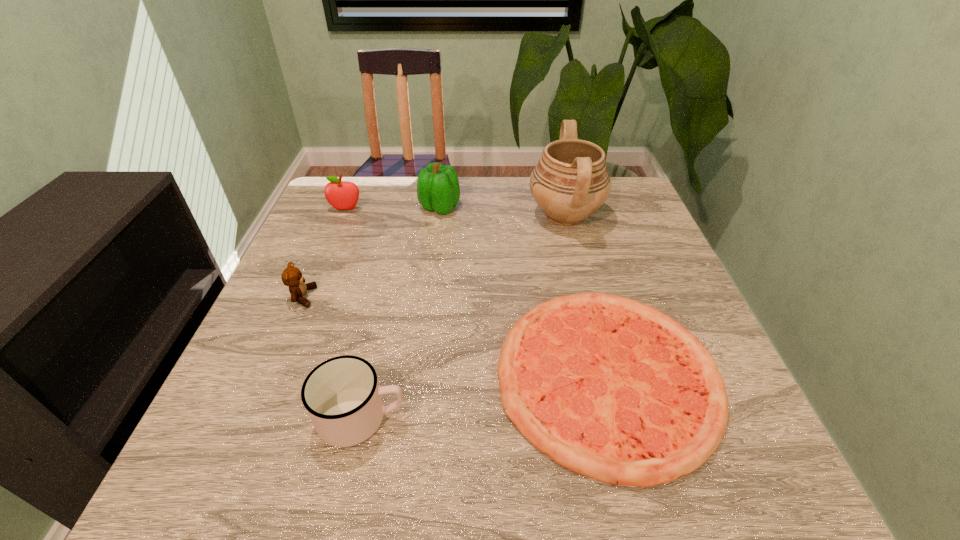
You are a GUI agent. You are given a task and a screenshot of the screen. Output one action in this format:
    pyautogui.click(x=<x>, y=<y>)
    Task: Click on the urn
    Image resolution: width=960 pixels, height=540 pixels.
    Given the screenshot: What is the action you would take?
    pyautogui.click(x=570, y=182)

Find the location of `bell pepper`. bell pepper is located at coordinates (438, 189).

In order to click on apple in this screenshot , I will do `click(342, 195)`.

Where is `mug`? Image resolution: width=960 pixels, height=540 pixels. mug is located at coordinates (343, 399).

Find the location of a particular element. teddy bear is located at coordinates coord(291,276).

The width and height of the screenshot is (960, 540). In order to click on the shortest object in this screenshot , I will do `click(610, 388)`.

Locate an element on the screen. This screenshot has width=960, height=540. vacant point located 0.210m on the front-facing side of the urn is located at coordinates (451, 215).

Find the location of `vacant space located 0.200m on the front-facing side of the urn`. vacant space located 0.200m on the front-facing side of the urn is located at coordinates (455, 215).

Where is `vacant space situated 0.050m on the front-facing side of the urn`? This screenshot has height=540, width=960. vacant space situated 0.050m on the front-facing side of the urn is located at coordinates (509, 215).

Where is `vacant region located 0.210m on the front of the second tallest object`? This screenshot has width=960, height=540. vacant region located 0.210m on the front of the second tallest object is located at coordinates point(432,269).